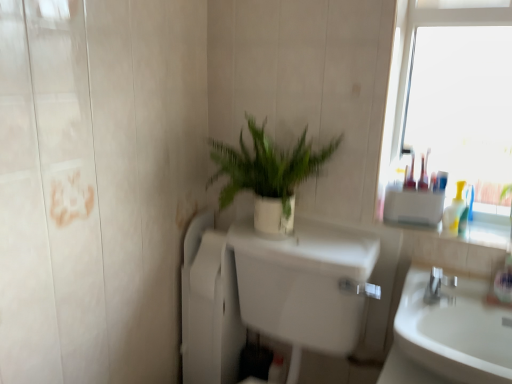
Find the location of a particular element. Image resolution: width=512 pixels, height=384 pixels. free space to the left of silver metallic faucet at right is located at coordinates (411, 297).